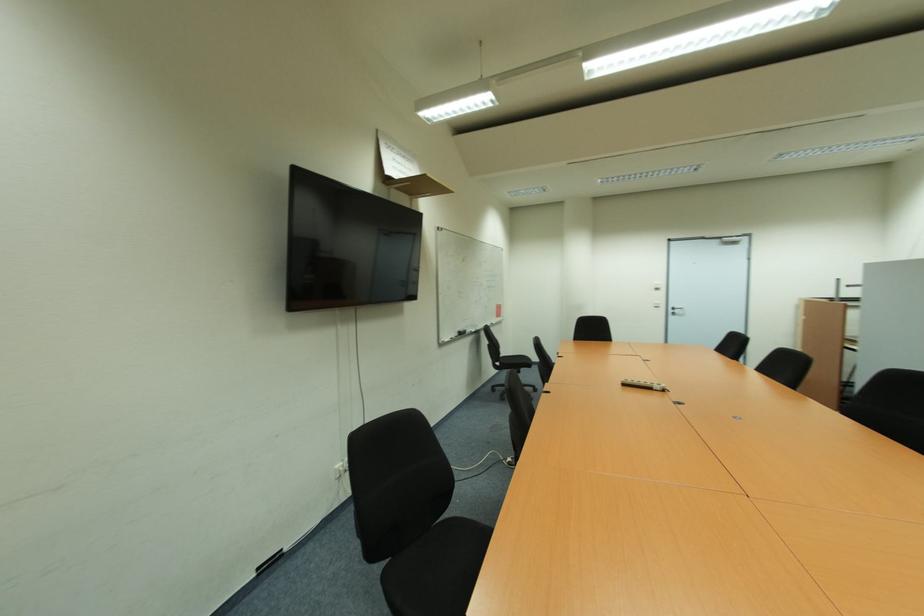
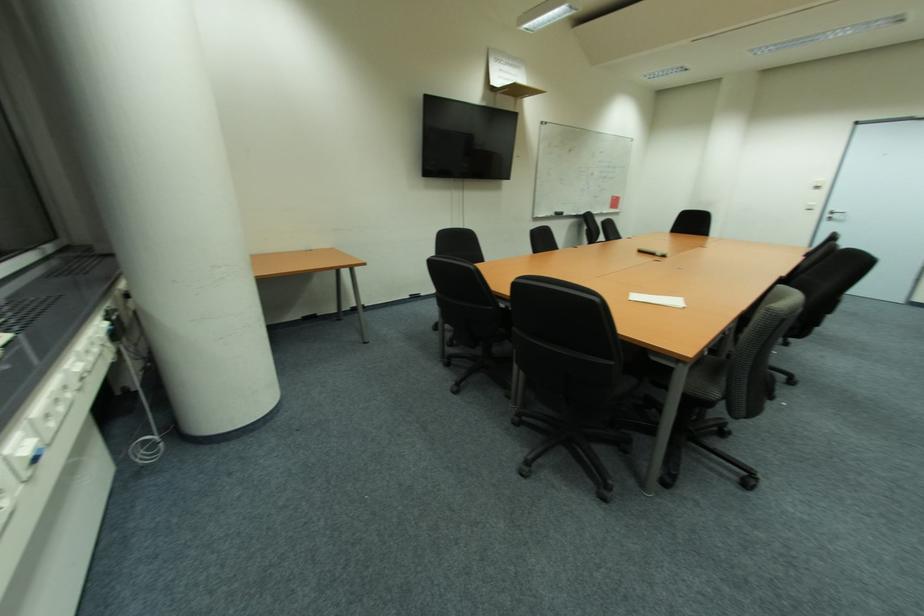
Find the pixel in the second image that matches [657,290] in the first image.

(820, 188)